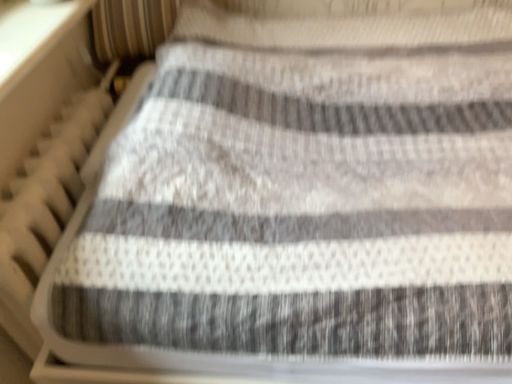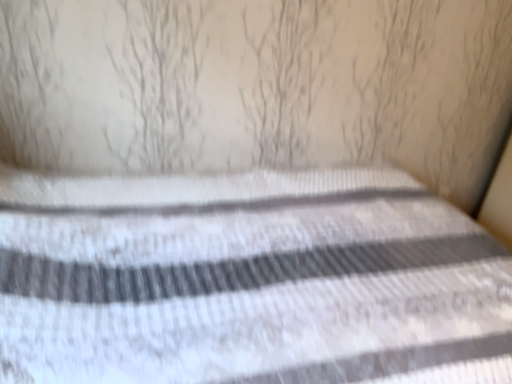
Question: How did the camera likely rotate when shooting the video?

Choices:
 (A) rotated upward
 (B) rotated downward

Answer: (A)